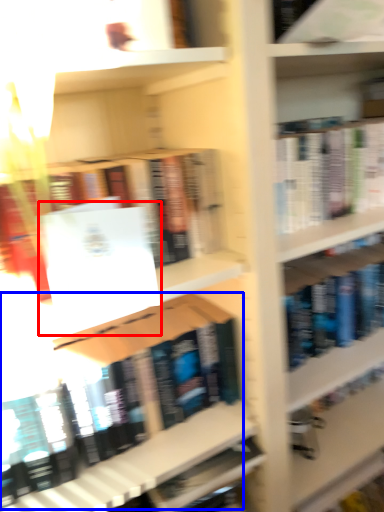
Question: Which point is further to the camera, paperback book (highlighted by a red box) or book (highlighted by a blue box)?

Choices:
 (A) paperback book
 (B) book

Answer: (B)